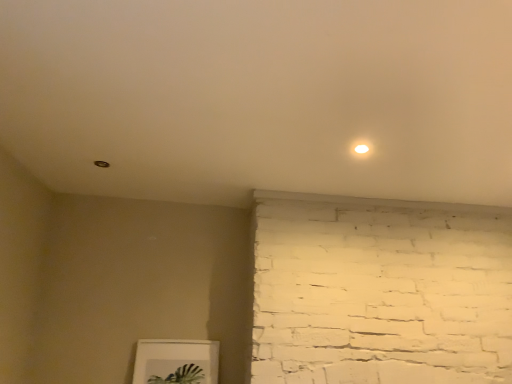
Question: Looking at their shapes, would you say white matte picture frame at lower center is wider or thinner than white matte light at upper right?

Choices:
 (A) thin
 (B) wide

Answer: (B)

Question: From the image's perspective, is white matte picture frame at lower center above or below white matte light at upper right?

Choices:
 (A) above
 (B) below

Answer: (B)

Question: Is white matte picture frame at lower center in front of or behind white matte light at upper right in the image?

Choices:
 (A) front
 (B) behind

Answer: (B)

Question: From the image's perspective, relative to white matte picture frame at lower center, is white matte light at upper right above or below?

Choices:
 (A) below
 (B) above

Answer: (B)

Question: Looking at the image, does white matte light at upper right seem bigger or smaller compared to white matte picture frame at lower center?

Choices:
 (A) big
 (B) small

Answer: (B)

Question: Visually, is white matte light at upper right positioned to the left or to the right of white matte picture frame at lower center?

Choices:
 (A) right
 (B) left

Answer: (A)

Question: Does point (356, 145) appear closer or farther from the camera than point (140, 375)?

Choices:
 (A) closer
 (B) farther

Answer: (A)